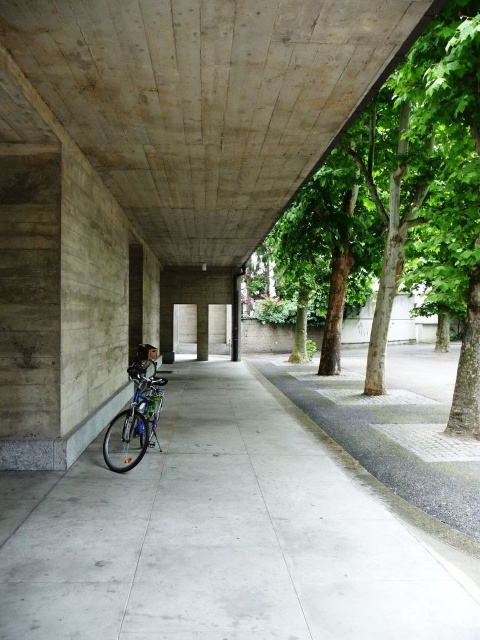
You are standing in the corridor and want to move from the bicycle to the paved area. Which point, point (2,628) or point (307,74), is closer to you as you start moving towards the paved area?

Point (2,628) is closer to the viewer than point (307,74), so you should head towards point (2,628) first.